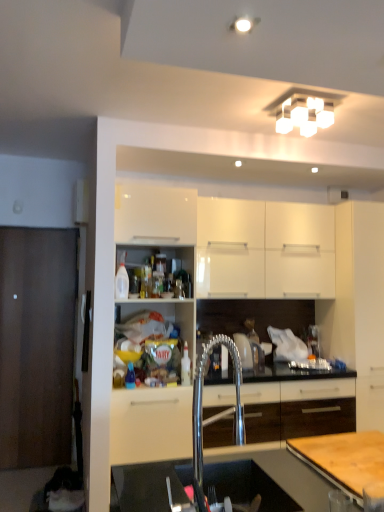
The height and width of the screenshot is (512, 384). In order to click on vacant region above white square light fixture at upper center (from a real-world perspective) in this screenshot , I will do `click(306, 108)`.